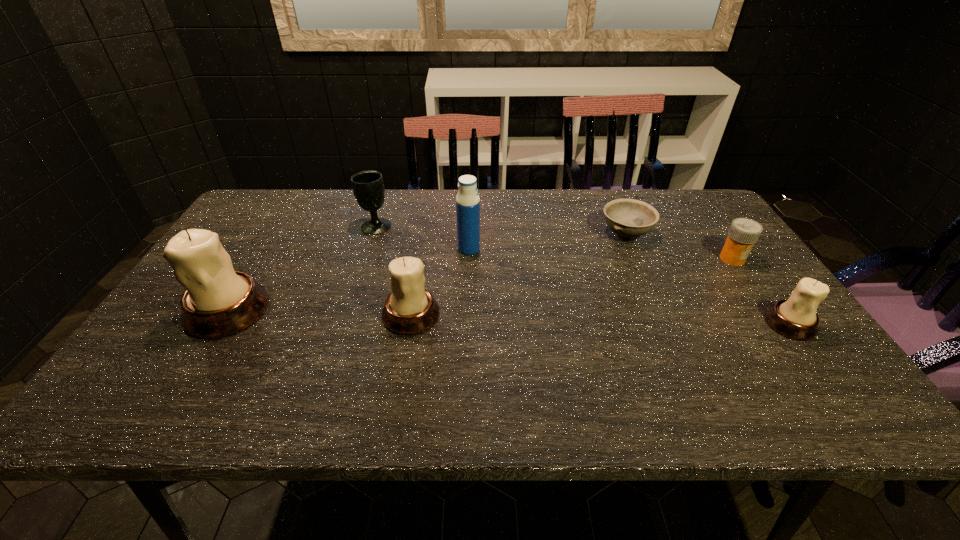
You are a GUI agent. You are given a task and a screenshot of the screen. Output one action in this format:
    pyautogui.click(x=<x>, y=<y>)
    Task: Click on the leftmost candle holder
    The image size is (960, 540).
    Given the screenshot: What is the action you would take?
    pyautogui.click(x=219, y=301)

Locate an element on the screen. This screenshot has height=540, width=960. the tallest candle holder is located at coordinates [219, 301].

Locate an element on the screen. The width and height of the screenshot is (960, 540). the second candle holder from left to right is located at coordinates (410, 309).

Image resolution: width=960 pixels, height=540 pixels. I want to click on the third object from left to right, so point(410,309).

Where is `the rightmost candle holder`? the rightmost candle holder is located at coordinates (795, 318).

You are a GUI agent. You are given a task and a screenshot of the screen. Output one action in this format:
    pyautogui.click(x=<x>, y=<y>)
    Task: Click on the shortest candle holder
    
    Given the screenshot: What is the action you would take?
    pyautogui.click(x=795, y=318)

This screenshot has width=960, height=540. I want to click on the sixth object from right to left, so click(368, 188).

At what (x,y) coordinates should I click in order to perform the action: click on water bottle. Please return your answer as a coordinate pair (x, y). Image resolution: width=960 pixels, height=540 pixels. Looking at the image, I should click on (467, 200).

The image size is (960, 540). I want to click on the fifth object from left to right, so click(x=629, y=218).

What are the coordinates of `bowl` in the screenshot? It's located at (629, 218).